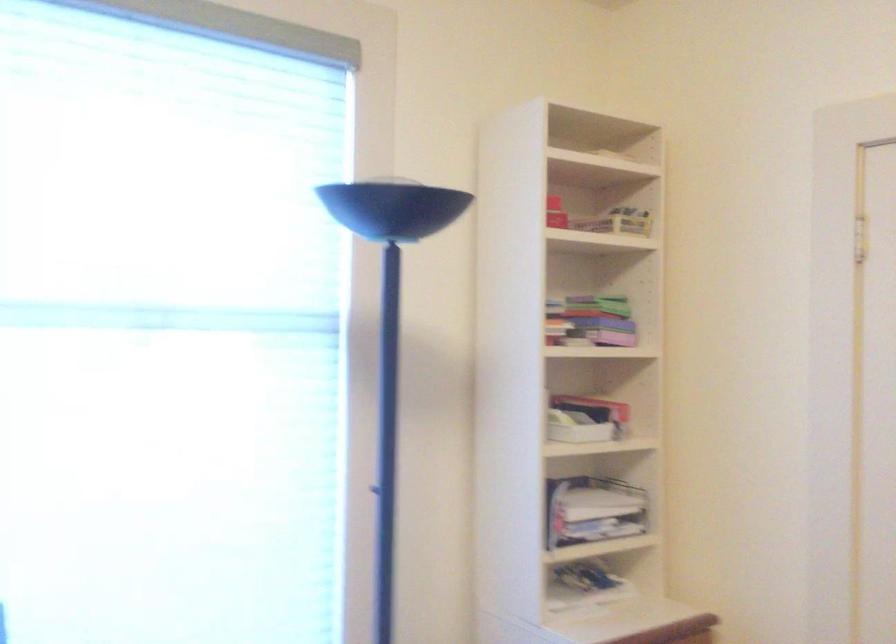
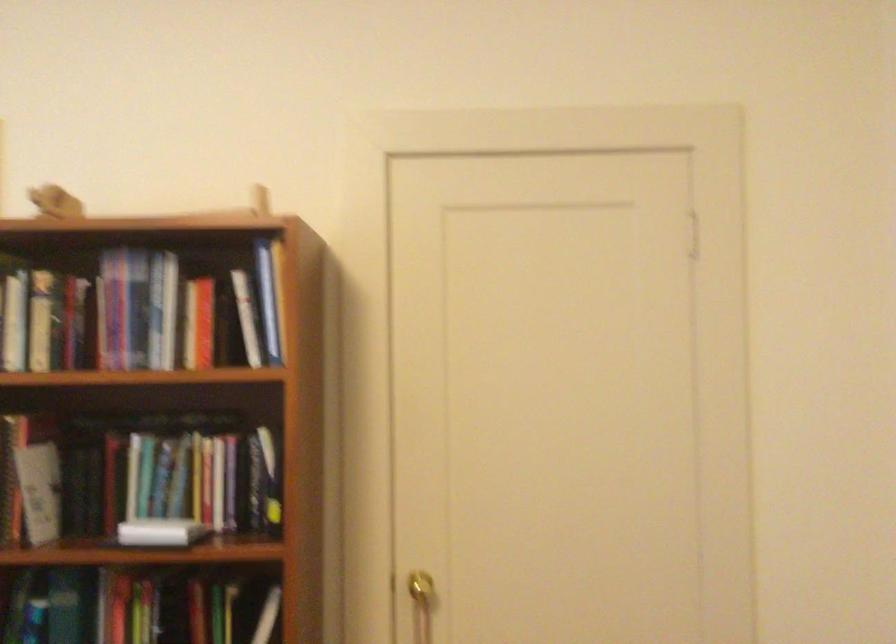
Question: The camera is either moving clockwise (left) or counter-clockwise (right) around the object. The first image is from the beginning of the video and the second image is from the end. Is the camera moving left or right when shooting the video?

Choices:
 (A) Left
 (B) Right

Answer: (A)